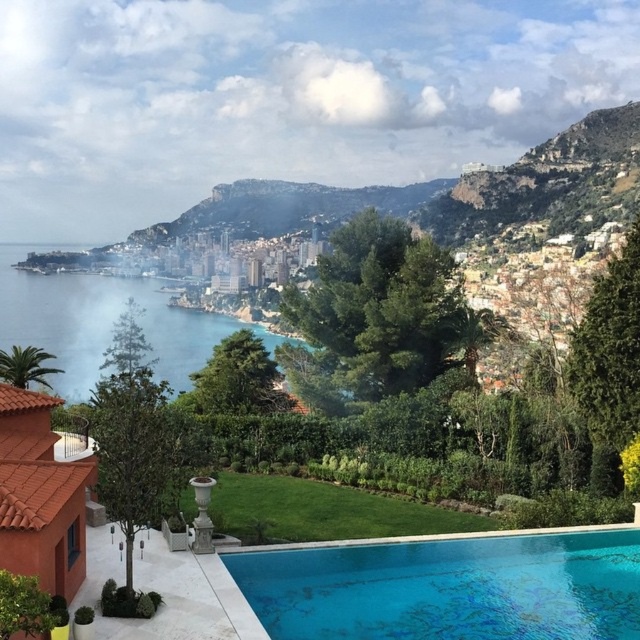
Between blue glassy swimming pool at lower center and clear blue water at center, which one is positioned lower?

blue glassy swimming pool at lower center is below.

Does blue glassy swimming pool at lower center have a smaller size compared to clear blue water at center?

Yes.

Is point (378, 596) positioned after point (166, 292)?

No, (378, 596) is closer to viewer.

Where is `blue glassy swimming pool at lower center`? This screenshot has width=640, height=640. blue glassy swimming pool at lower center is located at coordinates [x=449, y=588].